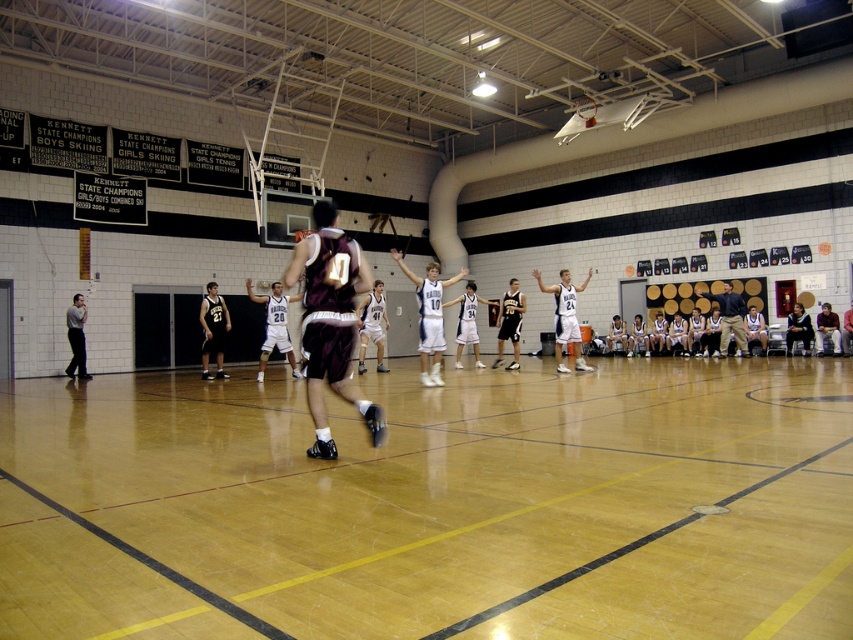
You are a referee observing the game. You notice two players wearing dark blue shirts and jerseys. Which player is standing behind the other? The dark blue shirt at right or the dark blue jersey at center?

The dark blue shirt at right is positioned over dark blue jersey at center, meaning the dark blue shirt at right is standing behind the dark blue jersey at center.

You are a spectator standing at the point labeled as point (165, 579) in the gymnasium. You want to throw a basketball to your friend who is standing 4 meters away from you. Is your friend within reach if you can throw the ball up to 4 meters?

The distance between point (165, 579) and the viewer is 3.89 meters, which is less than 4 meters. Therefore, your friend is within reach if you can throw the ball up to 4 meters.